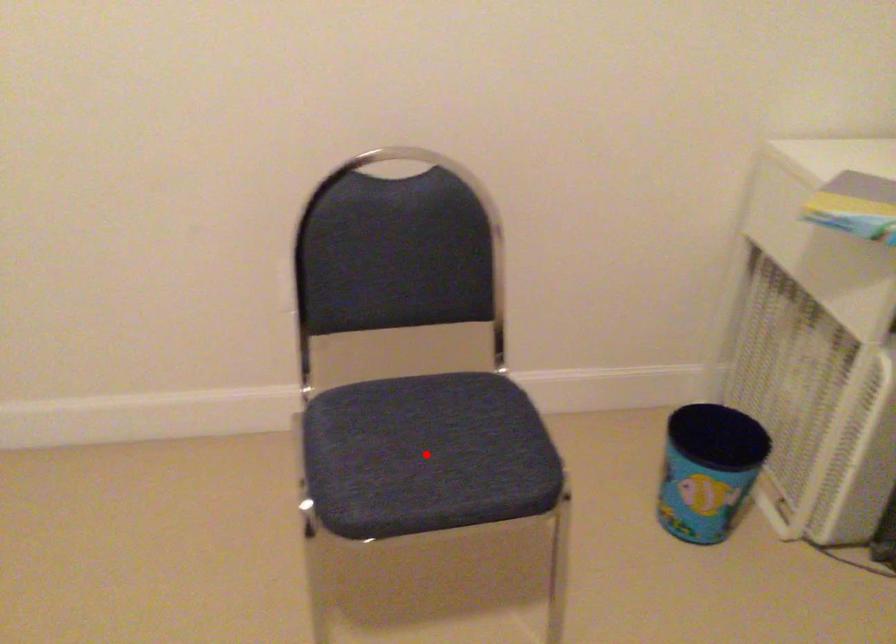
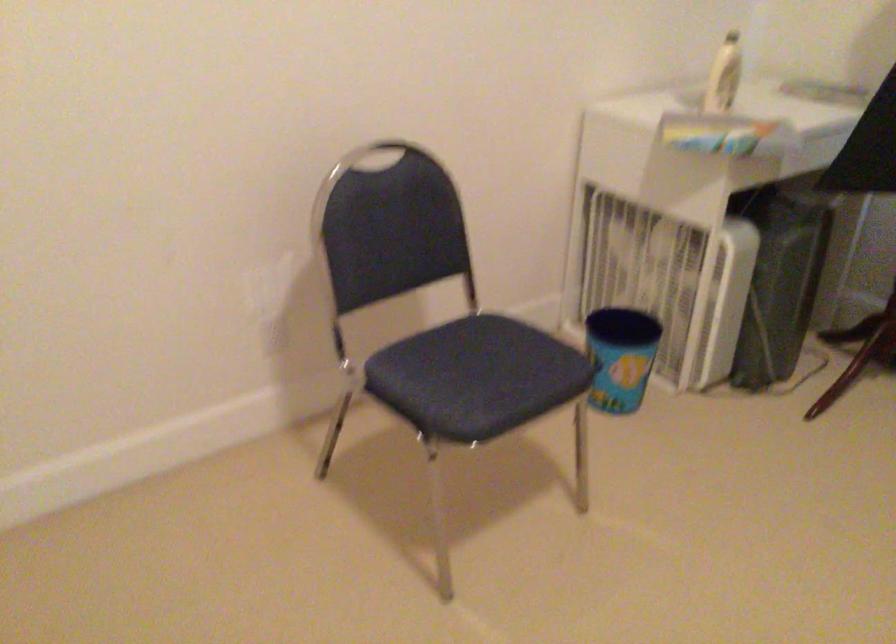
Question: I am providing you with two images of the same scene from different viewpoints. In image1, a red point is highlighted. Considering the same 3D point in image2, which of the following is correct?

Choices:
 (A) It is closer
 (B) It is farther

Answer: (B)